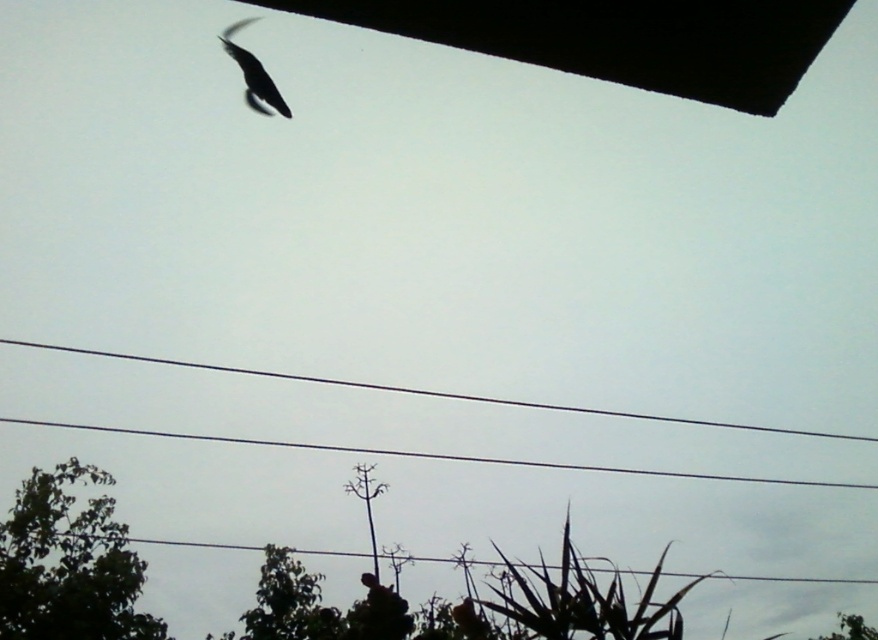
In the scene shown: Who is more forward, [160,632] or [868,632]?

Point [160,632] is more forward.

Is point (110, 484) positioned in front of point (846, 627)?

Yes, point (110, 484) is closer to viewer.

Identify the location of green leafy tree at lower left. (69, 564).

Who is more distant from viewer, (70, 496) or (255, 93)?

The point (70, 496) is more distant.

Measure the distance from green leafy tree at lower left to silvery glossy bird at upper left.

11.88 meters

Between point (24, 484) and point (227, 33), which one is positioned behind?

Point (24, 484)

Find the location of `green leafy tree at lower left`. green leafy tree at lower left is located at coordinates (69, 564).

Is silvery glossy bird at upper left to the right of green leafy tree at lower right from the viewer's perspective?

No, silvery glossy bird at upper left is not to the right of green leafy tree at lower right.

Between silvery glossy bird at upper left and green leafy tree at lower right, which one appears on the right side from the viewer's perspective?

Positioned to the right is green leafy tree at lower right.

This screenshot has height=640, width=878. Identify the location of silvery glossy bird at upper left. (253, 74).